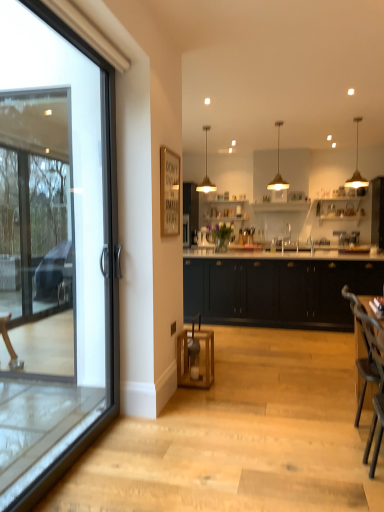
Question: Is the depth of gold metallic pendant light at upper right, positioned as the first lamp in right-to-left order, less than that of gold metallic pendant light at upper center, which is the 1th lamp in left-to-right order?

Choices:
 (A) yes
 (B) no

Answer: (A)

Question: Does gold metallic pendant light at upper right, the third lamp in the left-to-right sequence, appear on the right side of gold metallic pendant light at upper center, acting as the third lamp starting from the right?

Choices:
 (A) no
 (B) yes

Answer: (B)

Question: From a real-world perspective, is gold metallic pendant light at upper right, the third lamp in the left-to-right sequence, physically below gold metallic pendant light at upper center, which is the 1th lamp in left-to-right order?

Choices:
 (A) no
 (B) yes

Answer: (B)

Question: From a real-world perspective, is gold metallic pendant light at upper right, the third lamp in the left-to-right sequence, positioned over gold metallic pendant light at upper center, which is the 1th lamp in left-to-right order, based on gravity?

Choices:
 (A) yes
 (B) no

Answer: (B)

Question: From the image's perspective, is gold metallic pendant light at upper right, positioned as the first lamp in right-to-left order, below gold metallic pendant light at upper center, acting as the third lamp starting from the right?

Choices:
 (A) no
 (B) yes

Answer: (B)

Question: Looking at the image, does matte gold pendant light at upper center, which appears as the 2th lamp when viewed from the right, seem bigger or smaller compared to gold metallic pendant light at upper right, the third lamp in the left-to-right sequence?

Choices:
 (A) big
 (B) small

Answer: (B)

Question: From a real-world perspective, relative to gold metallic pendant light at upper right, positioned as the first lamp in right-to-left order, is matte gold pendant light at upper center, which appears as the 2th lamp when viewed from the right, vertically above or below?

Choices:
 (A) above
 (B) below

Answer: (B)

Question: In terms of width, does matte gold pendant light at upper center, which appears as the 2th lamp when viewed from the right, look wider or thinner when compared to gold metallic pendant light at upper right, positioned as the first lamp in right-to-left order?

Choices:
 (A) wide
 (B) thin

Answer: (B)

Question: Is point (283, 179) closer or farther from the camera than point (365, 179)?

Choices:
 (A) closer
 (B) farther

Answer: (B)

Question: Would you say gold metallic pendant light at upper right, positioned as the first lamp in right-to-left order, is inside or outside black matte cabinetry at center?

Choices:
 (A) inside
 (B) outside

Answer: (B)

Question: Is point (362, 182) positioned closer to the camera than point (183, 306)?

Choices:
 (A) closer
 (B) farther

Answer: (B)

Question: Looking at their shapes, would you say gold metallic pendant light at upper right, the third lamp in the left-to-right sequence, is wider or thinner than black matte cabinetry at center?

Choices:
 (A) thin
 (B) wide

Answer: (A)

Question: Is gold metallic pendant light at upper right, positioned as the first lamp in right-to-left order, taller or shorter than black matte cabinetry at center?

Choices:
 (A) tall
 (B) short

Answer: (B)

Question: Looking at their shapes, would you say black matte cabinetry at center is wider or thinner than wooden bar stool at center?

Choices:
 (A) thin
 (B) wide

Answer: (B)

Question: Is point (243, 303) closer or farther from the camera than point (211, 349)?

Choices:
 (A) farther
 (B) closer

Answer: (A)